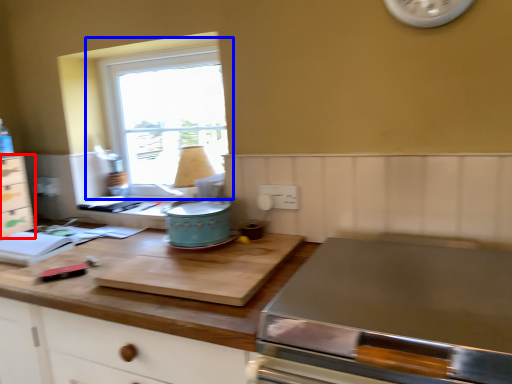
Question: Which object appears closest to the camera in this image, cabinetry (highlighted by a red box) or window (highlighted by a blue box)?

Choices:
 (A) cabinetry
 (B) window

Answer: (B)